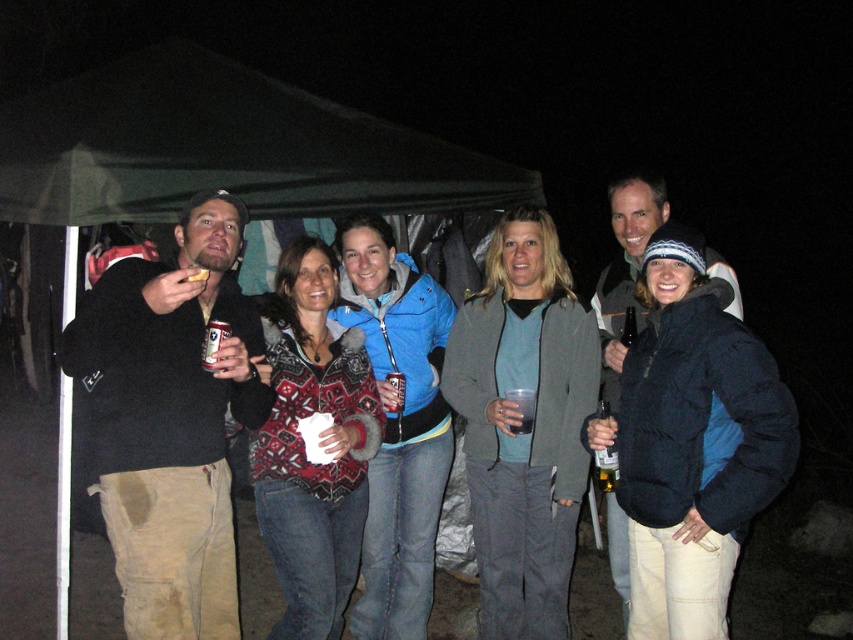
Question: Can you confirm if dark blue puffy jacket at center is bigger than blue fleece jacket at center?

Choices:
 (A) no
 (B) yes

Answer: (A)

Question: Is dark blue puffy jacket at center above blue fleece jacket at center?

Choices:
 (A) yes
 (B) no

Answer: (A)

Question: Is blue fleece jacket at center above dark matte cup at center?

Choices:
 (A) yes
 (B) no

Answer: (B)

Question: Which object is farther from the camera taking this photo?

Choices:
 (A) dark blue puffy jacket at center
 (B) blue fleece jacket at center

Answer: (B)

Question: Which of the following is the farthest from the observer?

Choices:
 (A) (515, 400)
 (B) (416, 420)

Answer: (B)

Question: Which object is the closest to the dark matte cup at center?

Choices:
 (A) green fabric tent at center
 (B) dark blue puffy jacket at center
 (C) blue fleece jacket at center

Answer: (B)